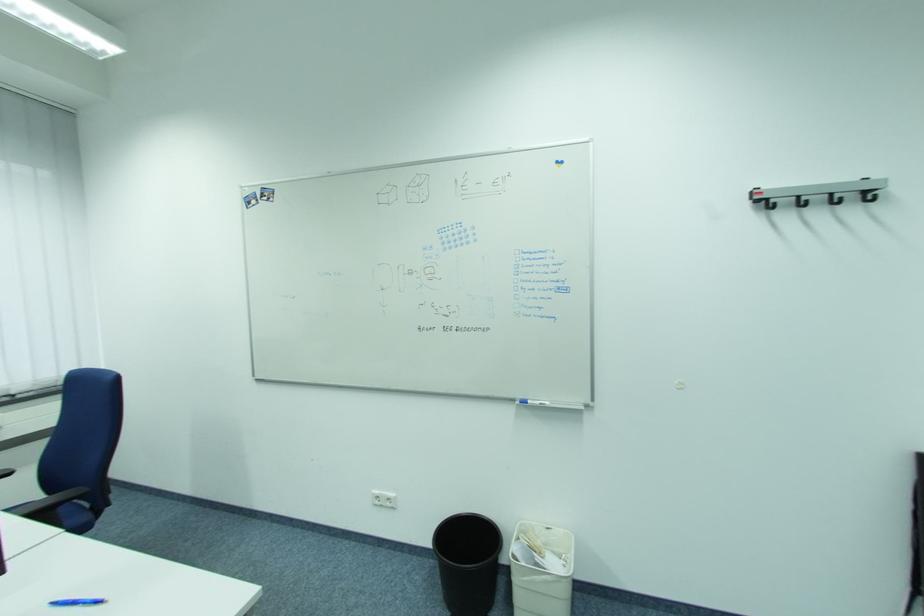
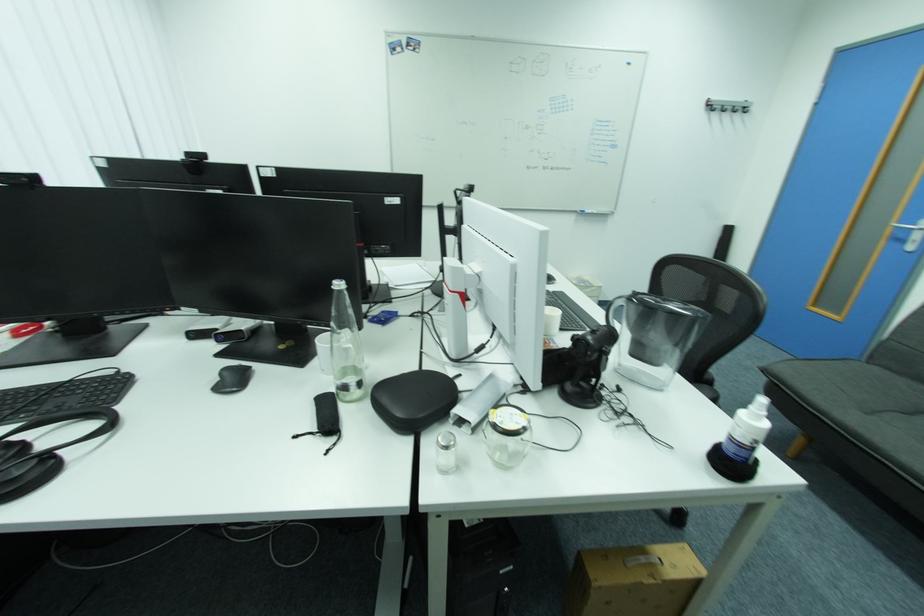
Which direction would the cameraman need to move to produce the second image?

The cameraman walked toward left, backward.